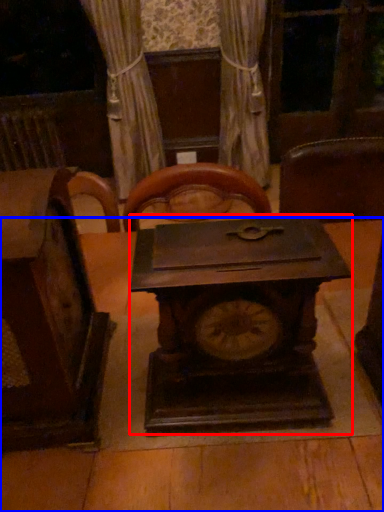
Question: Among these objects, which one is nearest to the camera, clock (highlighted by a red box) or table (highlighted by a blue box)?

Choices:
 (A) clock
 (B) table

Answer: (A)